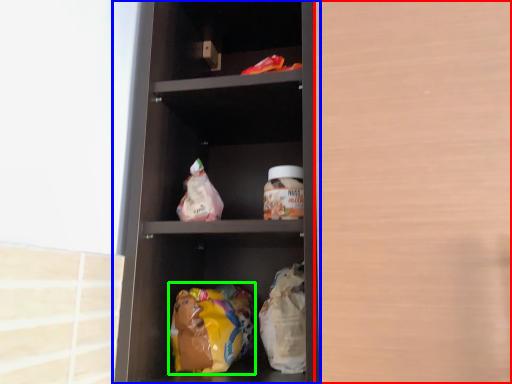
Question: Considering the real-world distances, which object is farthest from glass door (highlighted by a red box)? shelf (highlighted by a blue box) or food (highlighted by a green box)?

Choices:
 (A) shelf
 (B) food

Answer: (B)